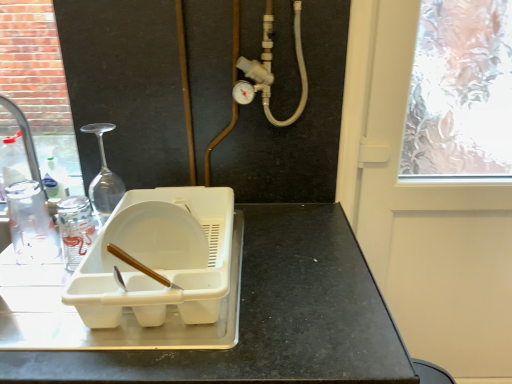
Where is `unoccupied area in front of clear plastic bottle at left`? This screenshot has height=384, width=512. unoccupied area in front of clear plastic bottle at left is located at coordinates (53, 309).